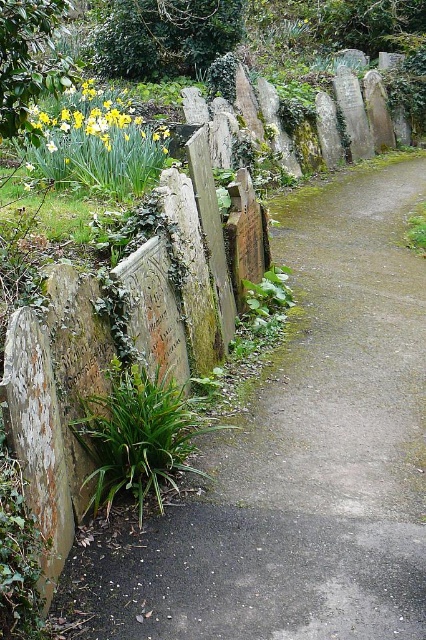
You are standing at the entrance of the cemetery and see the smooth stone path at center and the yellow matte daffodil at upper left. Which object is nearer to you?

The smooth stone path at center is closer to the viewer than the yellow matte daffodil at upper left.

You are a gardener planning to plant a new flower bed along the smooth stone path at center and the yellow matte daffodil at upper left. Which object has a narrower width?

The smooth stone path at center is thinner than the yellow matte daffodil at upper left, so the smooth stone path at center has a narrower width.

You are a gardener planning to plant a new flower bed. You need to decide whether the yellow matte daffodil at upper left can be placed along the smooth stone path at center. Based on their sizes, will there be enough space for the daffodil?

The smooth stone path at center occupies less space than yellow matte daffodil at upper left, so there is insufficient space to place the daffodil along the path.